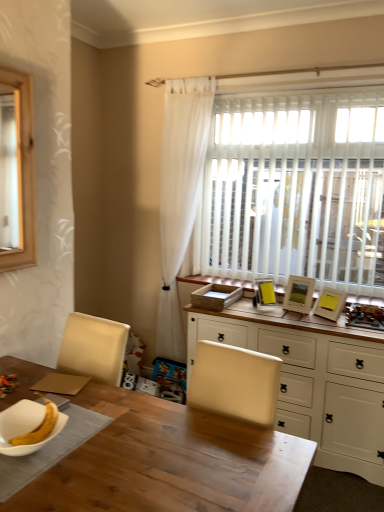
Question: Considering the relative positions of white glossy bowl at lower left and wooden picture frame at upper right, which ranks as the first picture frame in right-to-left order, in the image provided, is white glossy bowl at lower left behind wooden picture frame at upper right, which ranks as the first picture frame in right-to-left order,?

Choices:
 (A) no
 (B) yes

Answer: (A)

Question: From the image's perspective, would you say white glossy bowl at lower left is shown under wooden picture frame at upper right, which ranks as the first picture frame in right-to-left order?

Choices:
 (A) yes
 (B) no

Answer: (A)

Question: From a real-world perspective, is white glossy bowl at lower left below wooden picture frame at upper right, which ranks as the first picture frame in right-to-left order?

Choices:
 (A) yes
 (B) no

Answer: (A)

Question: Is wooden picture frame at upper right, which appears as the 3th picture frame when viewed from the left, inside white glossy bowl at lower left?

Choices:
 (A) yes
 (B) no

Answer: (B)

Question: Could you tell me if white glossy bowl at lower left is facing wooden picture frame at upper right, which appears as the 3th picture frame when viewed from the left?

Choices:
 (A) no
 (B) yes

Answer: (A)

Question: From the image's perspective, is white glossy bowl at lower left located above wooden picture frame at upper right, which appears as the 3th picture frame when viewed from the left?

Choices:
 (A) no
 (B) yes

Answer: (A)

Question: Considering the relative sizes of matte yellow picture frame at upper right, the first picture frame from the left, and white sheer curtain at upper right in the image provided, is matte yellow picture frame at upper right, the first picture frame from the left, taller than white sheer curtain at upper right?

Choices:
 (A) no
 (B) yes

Answer: (A)

Question: Does matte yellow picture frame at upper right, positioned as the third picture frame in right-to-left order, come behind white sheer curtain at upper right?

Choices:
 (A) yes
 (B) no

Answer: (B)

Question: Would you say white sheer curtain at upper right is part of matte yellow picture frame at upper right, the first picture frame from the left,'s contents?

Choices:
 (A) no
 (B) yes

Answer: (A)

Question: Is matte yellow picture frame at upper right, the first picture frame from the left, at the left side of white sheer curtain at upper right?

Choices:
 (A) yes
 (B) no

Answer: (B)

Question: From a real-world perspective, is matte yellow picture frame at upper right, the first picture frame from the left, positioned over white sheer curtain at upper right based on gravity?

Choices:
 (A) yes
 (B) no

Answer: (B)

Question: Is matte yellow picture frame at upper right, positioned as the third picture frame in right-to-left order, touching white sheer curtain at upper right?

Choices:
 (A) yes
 (B) no

Answer: (B)

Question: Is wooden table at center inside matte yellow picture frame at upper right, positioned as the third picture frame in right-to-left order?

Choices:
 (A) yes
 (B) no

Answer: (B)